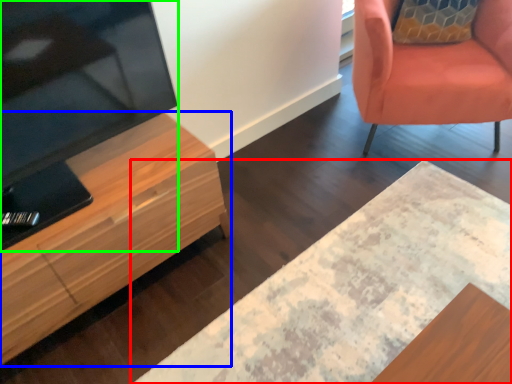
Question: Based on their relative distances, which object is farther from desk (highlighted by a red box)? Choose from cabinetry (highlighted by a blue box) and television (highlighted by a green box).

Choices:
 (A) cabinetry
 (B) television

Answer: (B)